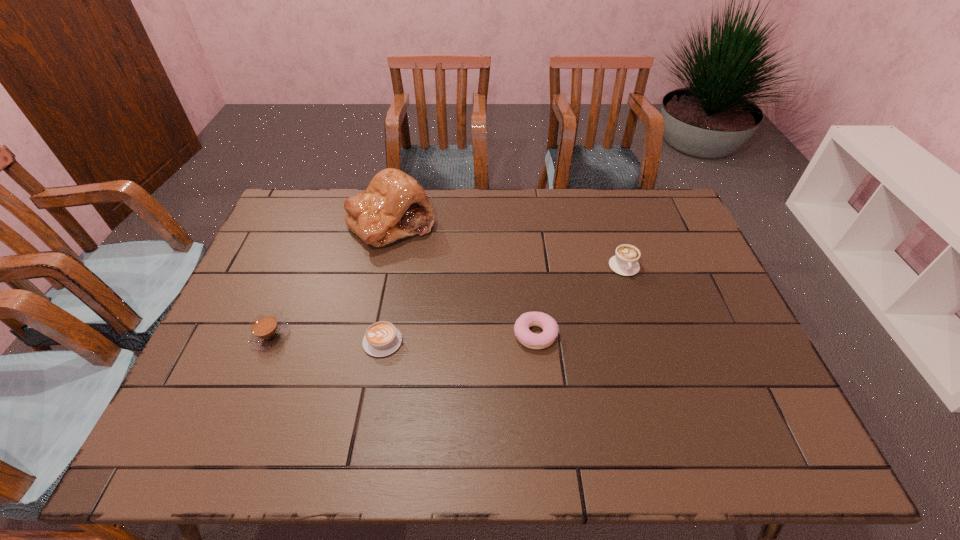
The width and height of the screenshot is (960, 540). I want to click on free space at the far right corner, so click(x=665, y=206).

Identify the location of free spot between the leftmost object and the farthest cappuccino. (447, 301).

Where is `free space between the bread and the fourth tallest object`? Image resolution: width=960 pixels, height=540 pixels. free space between the bread and the fourth tallest object is located at coordinates (464, 279).

Identify the location of empty space between the second object from right to left and the shortest object. (459, 338).

Locate an element on the screen. The height and width of the screenshot is (540, 960). free point between the leftmost object and the bread is located at coordinates (331, 279).

What are the coordinates of `free spot between the farthest cappuccino and the bread` in the screenshot? It's located at (508, 245).

Locate an element on the screen. This screenshot has width=960, height=540. free area in between the fourth object from left to right and the shortest object is located at coordinates (459, 338).

I want to click on vacant space that is in between the fourth object from left to right and the rightmost cappuccino, so click(x=580, y=301).

Image resolution: width=960 pixels, height=540 pixels. Find the location of `free space between the rightmost object and the tallest object`. free space between the rightmost object and the tallest object is located at coordinates (508, 245).

At what (x,y) coordinates should I click in order to perform the action: click on vacant area that lies between the fourth tallest object and the tallest object. Please return your answer as a coordinate pair (x, y). Looking at the image, I should click on (464, 279).